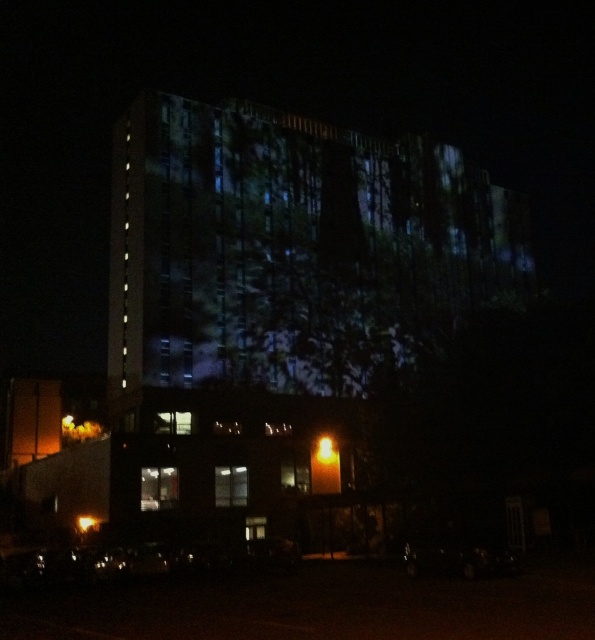
You are an architect analyzing the building facade projection. You notice two points marked on the image at coordinates point (x=317, y=458) and point (x=83, y=520). Based on the projection, which point is closer to the viewer?

Point (x=83, y=520) is closer to the viewer because point (x=317, y=458) is behind it.

You are standing in front of the building and notice two lights. The bright orange light at center and the amber glass light at lower left. Which light is taller?

The bright orange light at center is taller than the amber glass light at lower left.